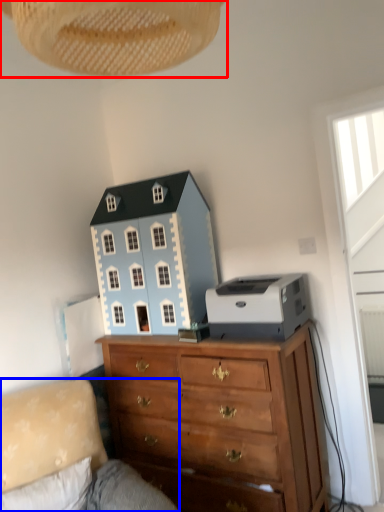
Question: Among these objects, which one is nearest to the camera, lamp (highlighted by a red box) or studio couch (highlighted by a blue box)?

Choices:
 (A) lamp
 (B) studio couch

Answer: (A)